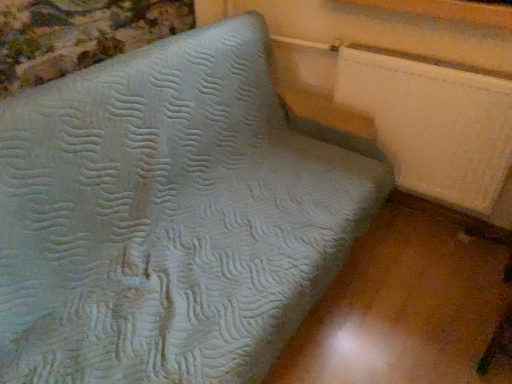
What do you see at coordinates (449, 10) in the screenshot? This screenshot has height=384, width=512. I see `white painted wood at upper right` at bounding box center [449, 10].

What is the approximate height of white painted wood at upper right?

white painted wood at upper right is 2.84 inches in height.

Locate an element on the screen. This screenshot has height=384, width=512. white painted wood at upper right is located at coordinates (449, 10).

Where is `white painted wood at upper right`? The image size is (512, 384). white painted wood at upper right is located at coordinates (449, 10).